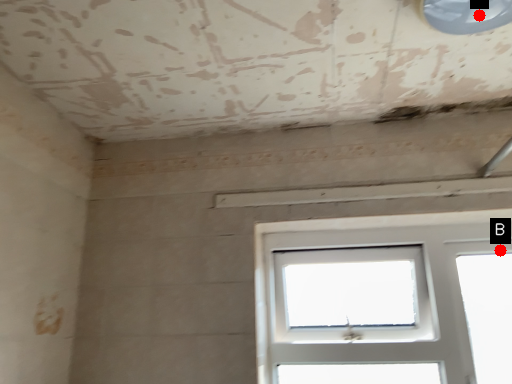
Question: Two points are circled on the image, labeled by A and B beside each circle. Among these points, which one is farthest from the camera?

Choices:
 (A) A is further
 (B) B is further

Answer: (B)